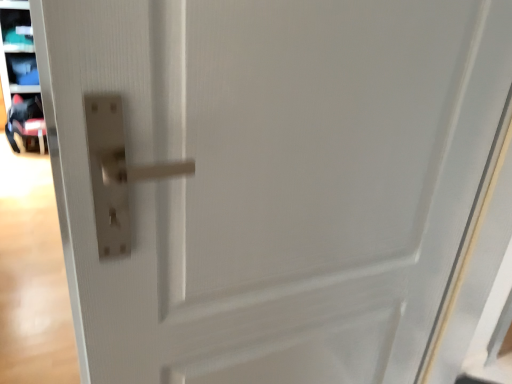
Question: Is matte plastic shelf at upper left next to black fabric baby carriage at left and touching it?

Choices:
 (A) yes
 (B) no

Answer: (B)

Question: Is matte plastic shelf at upper left looking in the opposite direction of black fabric baby carriage at left?

Choices:
 (A) no
 (B) yes

Answer: (A)

Question: Can you confirm if matte plastic shelf at upper left is wider than black fabric baby carriage at left?

Choices:
 (A) no
 (B) yes

Answer: (A)

Question: Is matte plastic shelf at upper left surrounding black fabric baby carriage at left?

Choices:
 (A) yes
 (B) no

Answer: (B)

Question: Is matte plastic shelf at upper left not inside black fabric baby carriage at left?

Choices:
 (A) yes
 (B) no

Answer: (A)

Question: From the image's perspective, is matte plastic shelf at upper left under black fabric baby carriage at left?

Choices:
 (A) no
 (B) yes

Answer: (A)

Question: Is black fabric baby carriage at left completely or partially outside of matte plastic shelf at upper left?

Choices:
 (A) no
 (B) yes

Answer: (B)

Question: Can matte plastic shelf at upper left be found inside black fabric baby carriage at left?

Choices:
 (A) yes
 (B) no

Answer: (B)

Question: Is black fabric baby carriage at left bigger than matte plastic shelf at upper left?

Choices:
 (A) no
 (B) yes

Answer: (B)

Question: From the image's perspective, is black fabric baby carriage at left under matte plastic shelf at upper left?

Choices:
 (A) yes
 (B) no

Answer: (A)

Question: Can you confirm if black fabric baby carriage at left is taller than matte plastic shelf at upper left?

Choices:
 (A) no
 (B) yes

Answer: (A)

Question: From the image's perspective, is black fabric baby carriage at left on matte plastic shelf at upper left?

Choices:
 (A) no
 (B) yes

Answer: (A)

Question: Looking at the image, does black fabric baby carriage at left seem bigger or smaller compared to matte plastic shelf at upper left?

Choices:
 (A) big
 (B) small

Answer: (A)